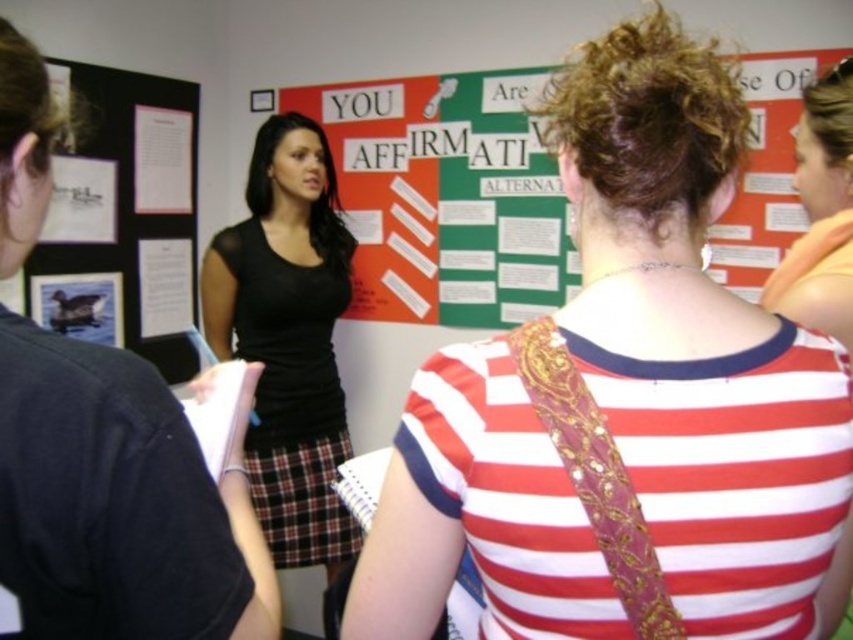
Question: Among these points, which one is nearest to the camera?

Choices:
 (A) (427, 92)
 (B) (804, 264)
 (C) (341, 566)
 (D) (683, 76)

Answer: (D)

Question: Is black mesh top at center to the left of orange fabric shirt at upper right from the viewer's perspective?

Choices:
 (A) yes
 (B) no

Answer: (A)

Question: Which object appears closest to the camera in this image?

Choices:
 (A) black mesh top at center
 (B) white striped shirt at center
 (C) orange fabric shirt at upper right
 (D) green paper poster at center

Answer: (B)

Question: Does green paper poster at center have a smaller size compared to orange fabric shirt at upper right?

Choices:
 (A) no
 (B) yes

Answer: (A)

Question: Does green paper poster at center appear on the right side of black mesh top at center?

Choices:
 (A) yes
 (B) no

Answer: (A)

Question: Which object is farther from the camera taking this photo?

Choices:
 (A) orange fabric shirt at upper right
 (B) green paper poster at center

Answer: (B)